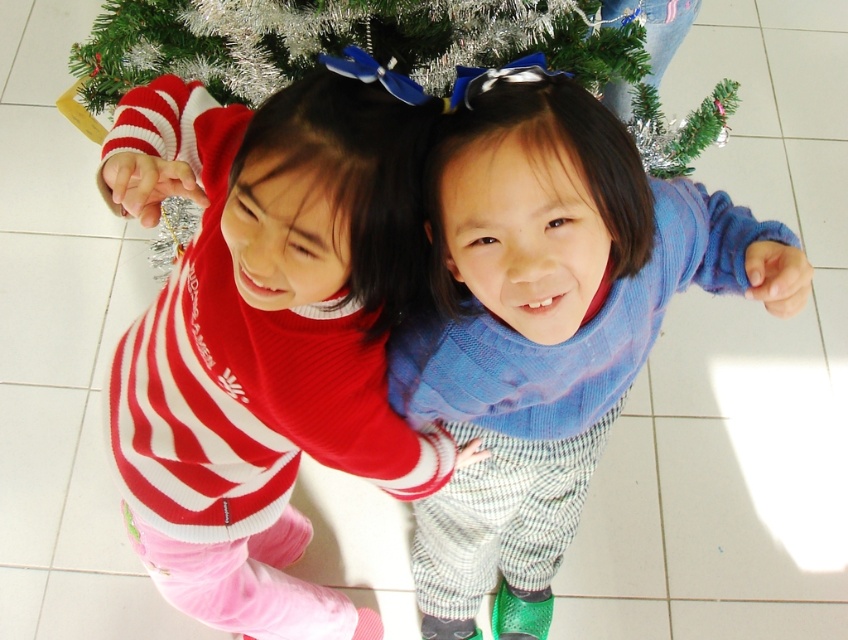
Question: Estimate the real-world distances between objects in this image. Which object is closer to the blue knitted sweater at center?

Choices:
 (A) matte red sweater at center
 (B) green tinsel christmas tree at center

Answer: (A)

Question: Is blue knitted sweater at center smaller than green tinsel christmas tree at center?

Choices:
 (A) yes
 (B) no

Answer: (B)

Question: Which of these objects is positioned closest to the blue knitted sweater at center?

Choices:
 (A) green tinsel christmas tree at center
 (B) matte red sweater at center

Answer: (B)

Question: Is blue knitted sweater at center positioned behind green tinsel christmas tree at center?

Choices:
 (A) no
 (B) yes

Answer: (A)

Question: Which object is positioned closest to the blue knitted sweater at center?

Choices:
 (A) green tinsel christmas tree at center
 (B) matte red sweater at center

Answer: (B)

Question: Is matte red sweater at center to the left of green tinsel christmas tree at center from the viewer's perspective?

Choices:
 (A) yes
 (B) no

Answer: (A)